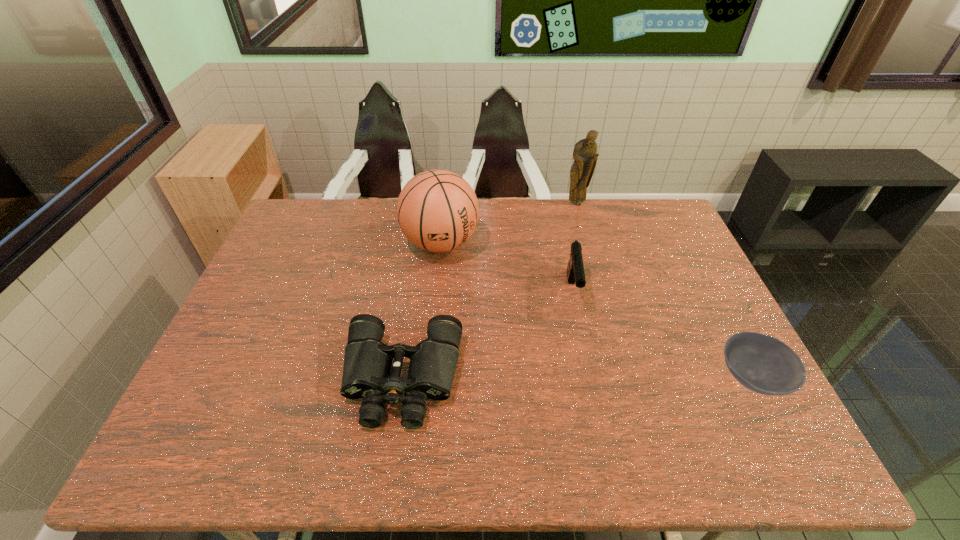
At what (x,y) coordinates should I click in order to perform the action: click on free location located on the front-facing side of the figurine. Please return your answer as a coordinate pair (x, y). Looking at the image, I should click on [x=577, y=235].

Where is `vacant space located on the front-facing side of the figurine`? The height and width of the screenshot is (540, 960). vacant space located on the front-facing side of the figurine is located at coordinates (578, 264).

The image size is (960, 540). I want to click on free region located 0.270m on the surface of the basketball near the brand logo, so click(x=496, y=326).

You are a GUI agent. You are given a task and a screenshot of the screen. Output one action in this format:
    pyautogui.click(x=<x>, y=<y>)
    Task: Click on the free location located 0.250m on the surface of the basketball near the brand logo
    The width and height of the screenshot is (960, 540).
    Given the screenshot: What is the action you would take?
    pyautogui.click(x=492, y=321)

Where is `free space located on the surface of the basketball near the brand logo`? The height and width of the screenshot is (540, 960). free space located on the surface of the basketball near the brand logo is located at coordinates (499, 331).

Locate an element on the screen. This screenshot has height=540, width=960. free spot located 0.110m at the barrel of the third shortest object is located at coordinates (580, 346).

What are the coordinates of `vacant space located 0.230m at the barrel of the third shortest object` in the screenshot? It's located at (585, 385).

What are the coordinates of `vacant area located 0.240m at the barrel of the third shortest object` in the screenshot? It's located at (585, 388).

The image size is (960, 540). Identify the location of figurine that is at the far edge. (585, 155).

Image resolution: width=960 pixels, height=540 pixels. Find the location of `basketball positioned at the far edge`. basketball positioned at the far edge is located at coordinates (437, 210).